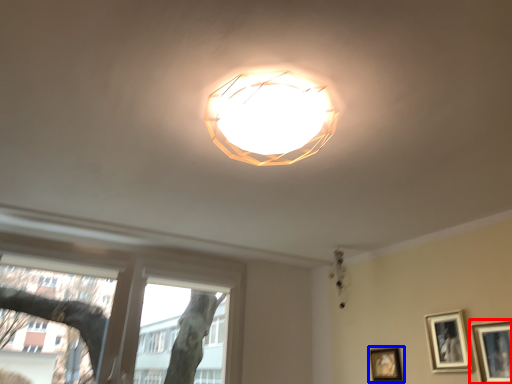
Question: Which object appears closest to the camera in this image, picture frame (highlighted by a red box) or picture frame (highlighted by a blue box)?

Choices:
 (A) picture frame
 (B) picture frame

Answer: (A)